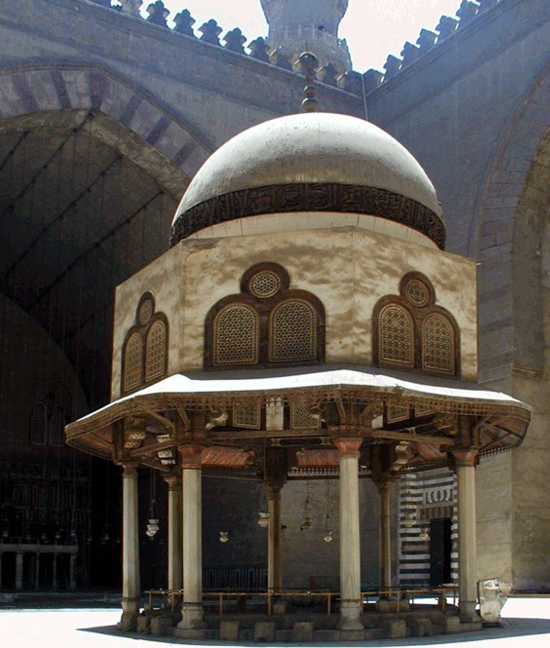
Where is `poles/pillars`? This screenshot has height=648, width=550. poles/pillars is located at coordinates (469, 492), (348, 496), (190, 510), (135, 512).